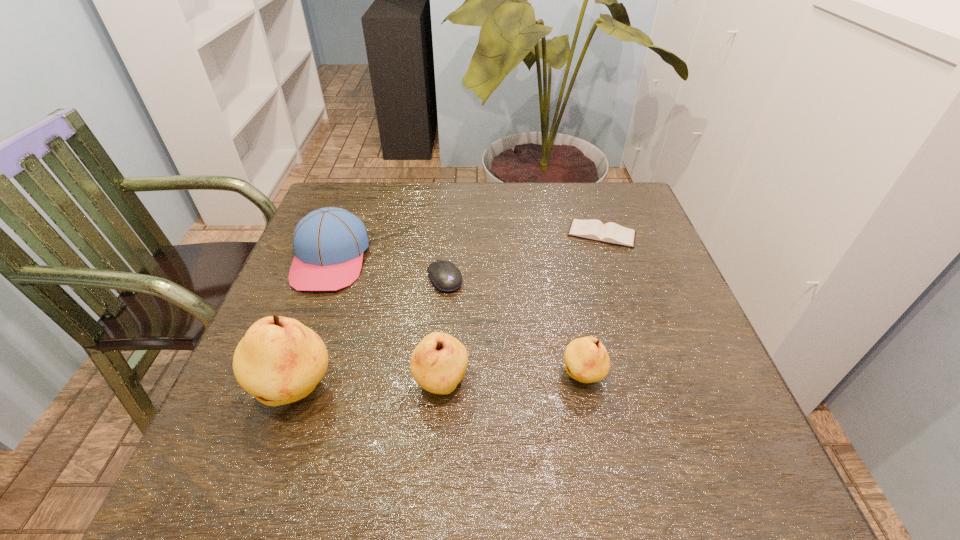
At what (x,y) coordinates should I click in order to perform the action: click on vacant area in the image that satisfies the following two spatial constraints: 1. on the front-facing side of the leftmost pear; 2. on the left side of the baseball cap. Please return your answer as a coordinate pair (x, y). Looking at the image, I should click on (280, 392).

Where is `vacant point that satisfies the following two spatial constraints: 1. on the front-facing side of the second tallest pear; 2. on the right side of the baseball cap`? The height and width of the screenshot is (540, 960). vacant point that satisfies the following two spatial constraints: 1. on the front-facing side of the second tallest pear; 2. on the right side of the baseball cap is located at coordinates pos(283,384).

This screenshot has height=540, width=960. In order to click on vacant point that satisfies the following two spatial constraints: 1. on the back side of the shortest object; 2. on the left side of the computer mouse in this screenshot , I will do `click(448, 234)`.